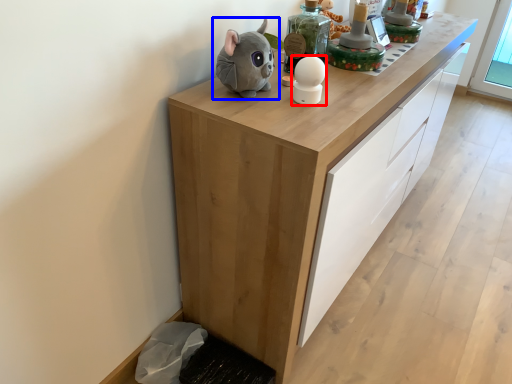
Question: Which object is further to the camera taking this photo, toy (highlighted by a red box) or toy (highlighted by a blue box)?

Choices:
 (A) toy
 (B) toy

Answer: (A)